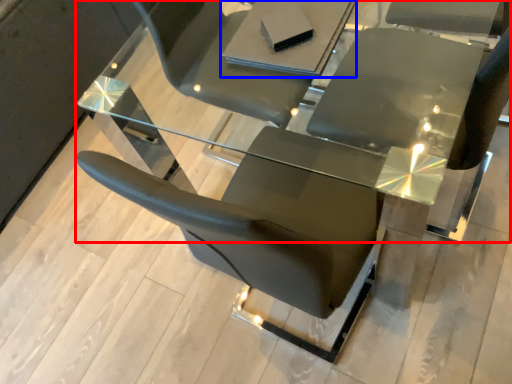
Question: Which of the following is the closest to the observer, table (highlighted by a red box) or table (highlighted by a blue box)?

Choices:
 (A) table
 (B) table

Answer: (A)